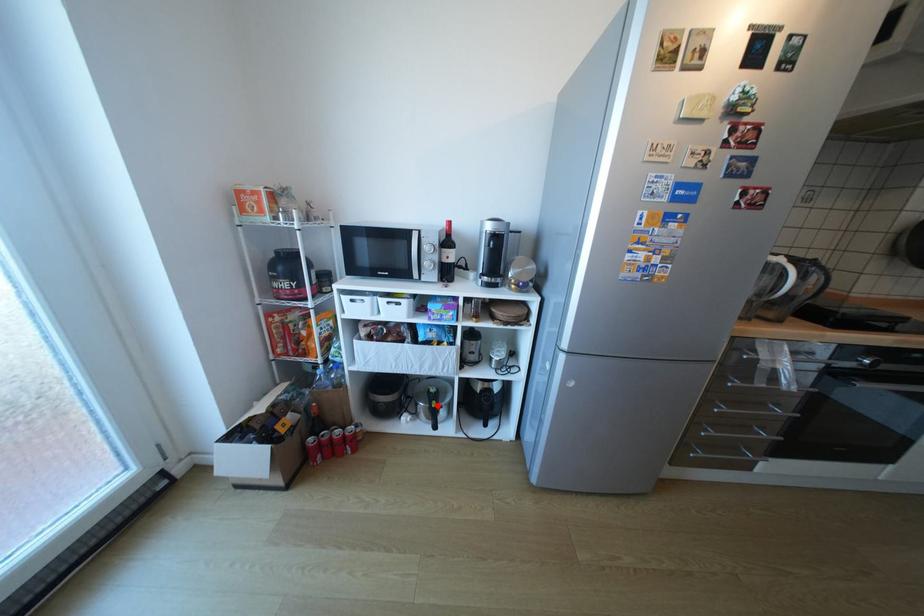
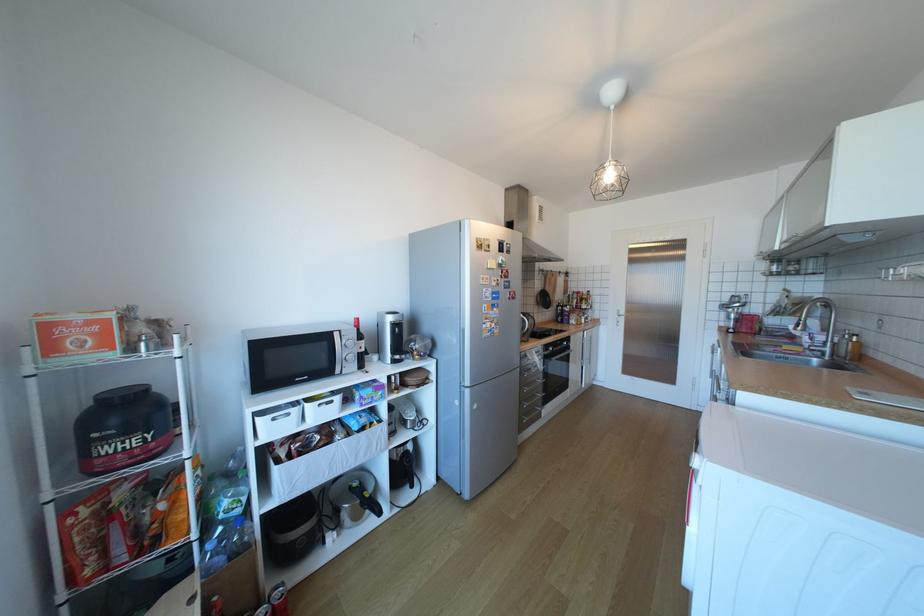
In the second image, find the point that corresponds to the highlighted location in the first image.

(369, 501)